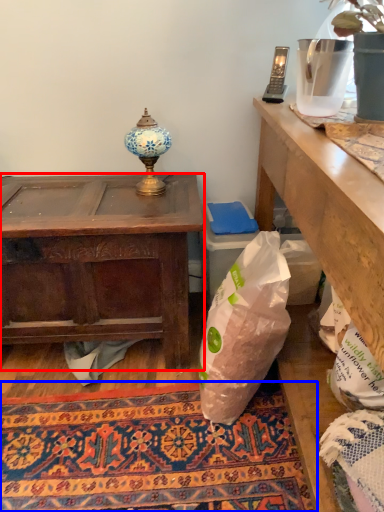
Question: Which object is further to the camera taking this photo, desk (highlighted by a red box) or mat (highlighted by a blue box)?

Choices:
 (A) desk
 (B) mat

Answer: (A)